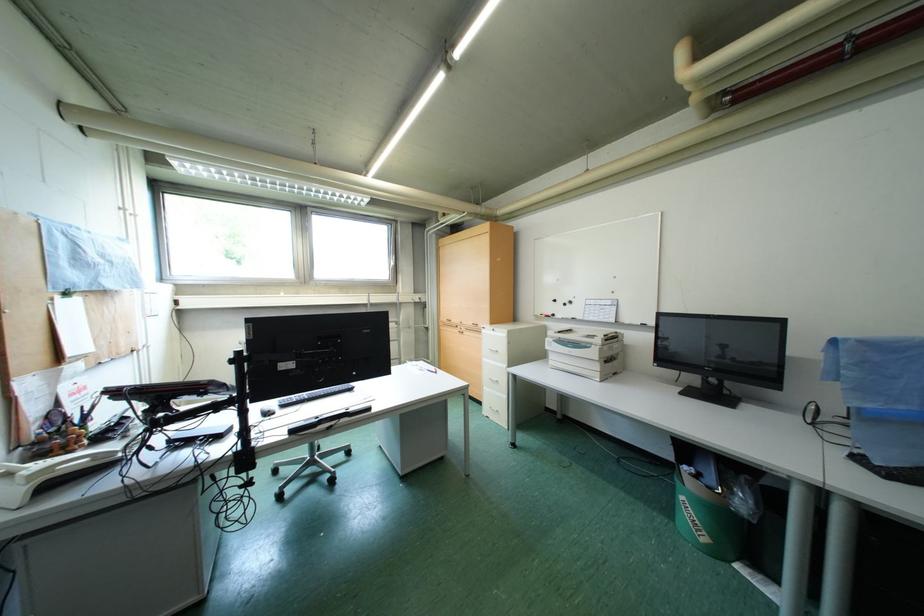
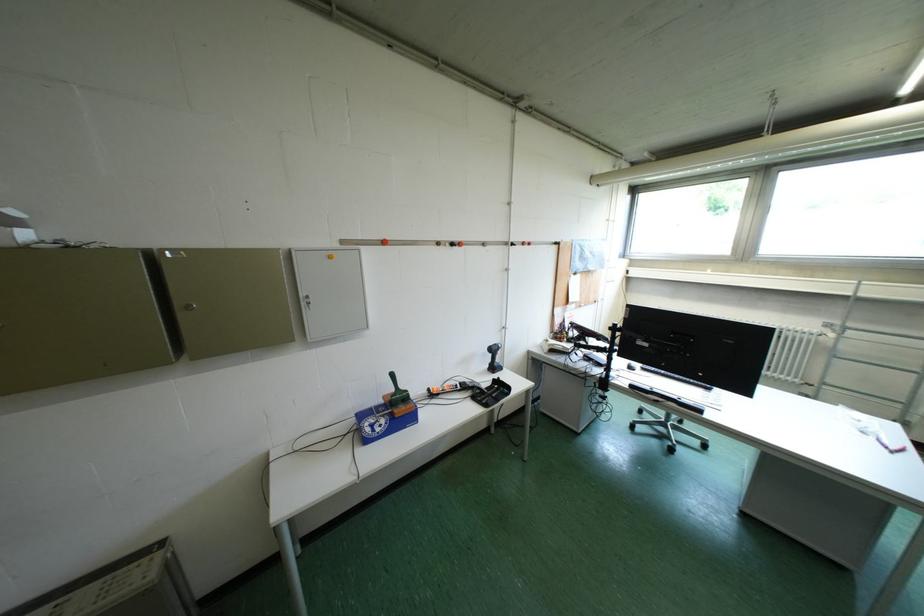
Question: The camera is either moving clockwise (left) or counter-clockwise (right) around the object. The first image is from the beginning of the video and the second image is from the end. Is the camera moving left or right when shooting the video?

Choices:
 (A) Left
 (B) Right

Answer: (B)